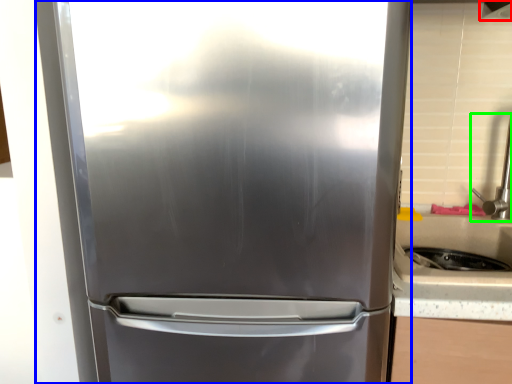
Question: Considering the real-world distances, which object is farthest from exhaust hood (highlighted by a red box)? refrigerator (highlighted by a blue box) or faucet (highlighted by a green box)?

Choices:
 (A) refrigerator
 (B) faucet

Answer: (A)